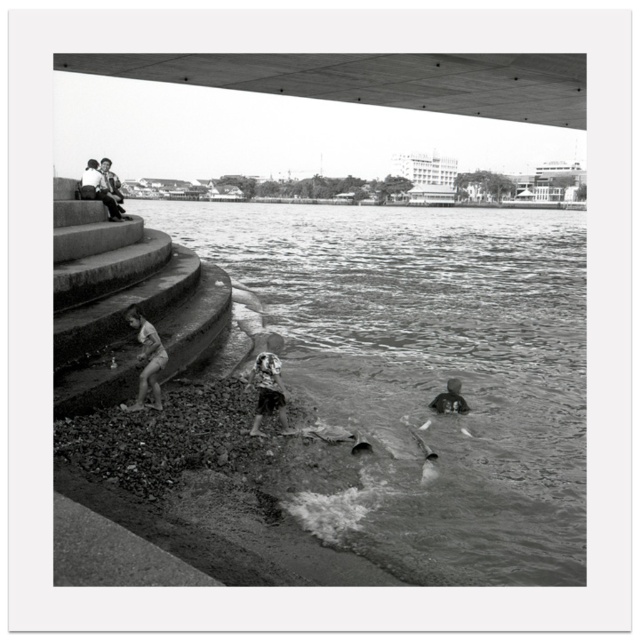
Between smooth stone man at upper left and dark gray fabric person at lower center, which one is positioned lower?

dark gray fabric person at lower center

Is smooth stone man at upper left taller than dark gray fabric person at lower center?

Indeed, smooth stone man at upper left has a greater height compared to dark gray fabric person at lower center.

Where is `smooth stone man at upper left`? smooth stone man at upper left is located at coordinates (99, 189).

Which is below, smooth skin child at lower left or dark gray fabric person at lower center?

dark gray fabric person at lower center is below.

Is point (141, 333) closer to viewer compared to point (454, 403)?

Yes, point (141, 333) is in front of point (454, 403).

Locate an element on the screen. Image resolution: width=640 pixels, height=640 pixels. smooth skin child at lower left is located at coordinates (147, 358).

Consider the image. Does smooth concrete stairs at left come in front of smooth stone man at upper left?

Yes, it is.

Does point (198, 337) lie in front of point (106, 202)?

Yes, it is.

Identify the location of smooth concrete stairs at left. The width and height of the screenshot is (640, 640). (122, 300).